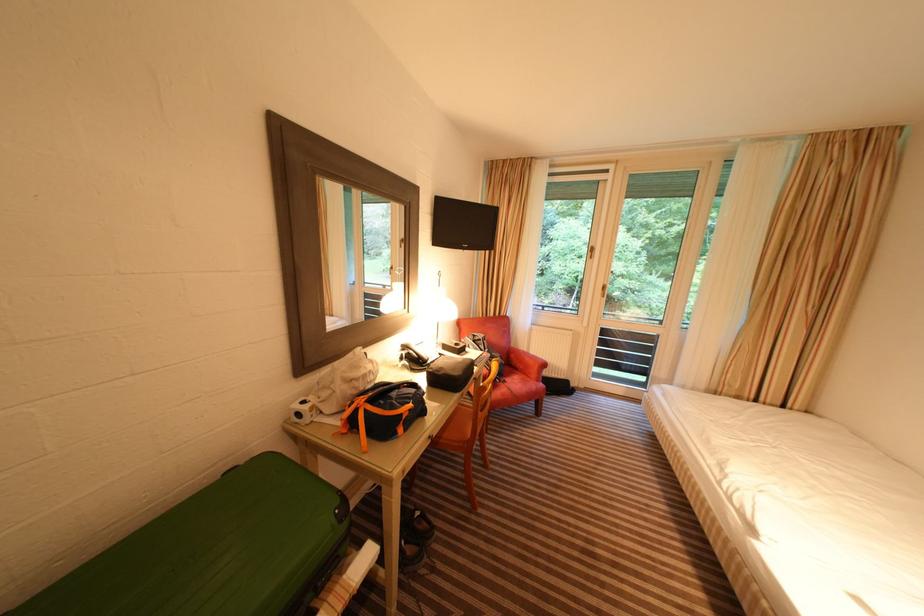
Where would you lift the black telephone receiver? Please return your answer as a coordinate pair (x, y).

(414, 355)